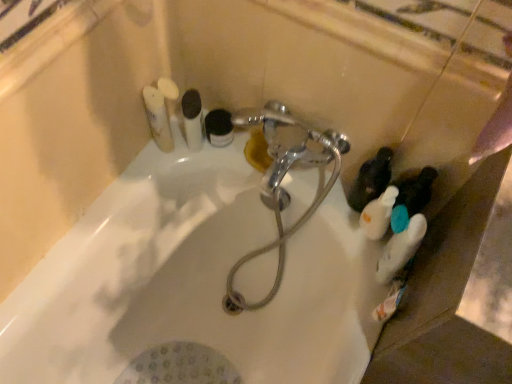
Where is `vacant space in front of white matte toothbrushes at upper left, arranged as the 5th toiletry when viewed from the right`? vacant space in front of white matte toothbrushes at upper left, arranged as the 5th toiletry when viewed from the right is located at coordinates (152, 173).